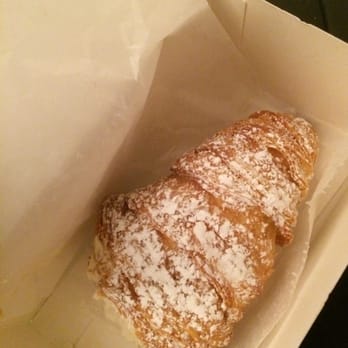
This screenshot has width=348, height=348. Identify the location of box. (271, 74).